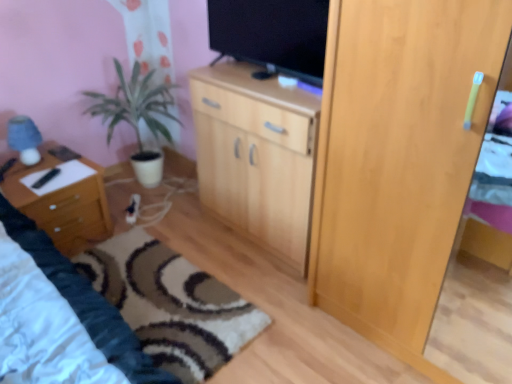
I want to click on carpet with swirl pattern at lower center, so click(x=170, y=304).

Describe the element at coordinates (170, 304) in the screenshot. I see `carpet with swirl pattern at lower center` at that location.

The width and height of the screenshot is (512, 384). Identify the location of green matte plant at left. (137, 117).

This screenshot has height=384, width=512. Identify the location of black glossy tv at upper center. (272, 35).

The width and height of the screenshot is (512, 384). In order to click on wooden cabinet at center in this screenshot , I will do (256, 156).

Image resolution: width=512 pixels, height=384 pixels. What are the coordinates of `light wood cupboard at right` in the screenshot? It's located at (398, 160).

Is black glossy tv at upper center completely or partially inside light wood cupboard at right?

No, black glossy tv at upper center is not surrounded by light wood cupboard at right.

Between point (443, 168) and point (287, 13), which one is positioned behind?

The point (287, 13) is farther from the camera.

From a real-world perspective, is light wood cupboard at right below black glossy tv at upper center?

Yes.

In the scene shown: Is black glossy tv at upper center positioned far away from wooden nightstand at left?

black glossy tv at upper center is positioned a significant distance from wooden nightstand at left.

Is black glossy tv at upper center looking in the opposite direction of wooden nightstand at left?

black glossy tv at upper center is not turned away from wooden nightstand at left.

Is point (294, 38) behind point (26, 172)?

No, it is not.

Considering the sizes of wooden cabinet at center and carpet with swirl pattern at lower center in the image, is wooden cabinet at center taller or shorter than carpet with swirl pattern at lower center?

Clearly, wooden cabinet at center is taller compared to carpet with swirl pattern at lower center.

Can you confirm if wooden cabinet at center is positioned to the right of carpet with swirl pattern at lower center?

Yes, wooden cabinet at center is to the right of carpet with swirl pattern at lower center.

Considering the points (308, 141) and (153, 352), which point is behind, point (308, 141) or point (153, 352)?

Point (308, 141)

Based on the photo, is wooden cabinet at center aimed at carpet with swirl pattern at lower center?

Yes, wooden cabinet at center is aimed at carpet with swirl pattern at lower center.

From the image's perspective, between light wood cupboard at right and carpet with swirl pattern at lower center, who is located below?

carpet with swirl pattern at lower center appears lower in the image.

Locate an element on the screen. cupboard above the carpet with swirl pattern at lower center (from the image's perspective) is located at coordinates (x=398, y=160).

Considering the positions of point (394, 164) and point (152, 305), is point (394, 164) closer or farther from the camera than point (152, 305)?

Point (394, 164) is closer to the camera than point (152, 305).

Is carpet with swirl pattern at lower center at the back of light wood cupboard at right?

No, light wood cupboard at right is not facing away from carpet with swirl pattern at lower center.

Does light wood cupboard at right have a lesser width compared to green matte plant at left?

No, light wood cupboard at right is not thinner than green matte plant at left.

Considering the sizes of objects light wood cupboard at right and green matte plant at left in the image provided, who is taller, light wood cupboard at right or green matte plant at left?

With more height is light wood cupboard at right.

From a real-world perspective, which object rests below the other?

green matte plant at left, from a real-world perspective.

From the image's perspective, does light wood cupboard at right appear lower than green matte plant at left?

Yes, from the image's perspective, light wood cupboard at right is below green matte plant at left.

Can you see carpet with swirl pattern at lower center touching light wood cupboard at right?

carpet with swirl pattern at lower center is not next to light wood cupboard at right, and they're not touching.

Does carpet with swirl pattern at lower center have a lesser width compared to light wood cupboard at right?

In fact, carpet with swirl pattern at lower center might be wider than light wood cupboard at right.

Which of these two, carpet with swirl pattern at lower center or light wood cupboard at right, is bigger?

light wood cupboard at right is bigger.

Consider the image. From a real-world perspective, is carpet with swirl pattern at lower center above or below light wood cupboard at right?

carpet with swirl pattern at lower center is situated lower than light wood cupboard at right in the real world.

Is light wood cupboard at right facing towards wooden cabinet at center?

No, light wood cupboard at right is not aimed at wooden cabinet at center.

Does point (403, 51) lie behind point (278, 173)?

That is False.

From the image's perspective, between light wood cupboard at right and wooden cabinet at center, which one is located above?

wooden cabinet at center appears higher in the image.

Measure the distance from light wood cupboard at right to wooden cabinet at center.

A distance of 16.53 inches exists between light wood cupboard at right and wooden cabinet at center.

Identify the location of television behind the light wood cupboard at right. This screenshot has width=512, height=384. (272, 35).

Where is `nightstand on the left of black glossy tv at upper center`? nightstand on the left of black glossy tv at upper center is located at coordinates (63, 205).

From the image, which object appears to be nearer to black glossy tv at upper center, light wood cupboard at right or wooden nightstand at left?

light wood cupboard at right is closer to black glossy tv at upper center.

In the scene shown: Based on their spatial positions, is wooden cabinet at center or light wood cupboard at right further from black glossy tv at upper center?

light wood cupboard at right lies further to black glossy tv at upper center than the other object.

Estimate the real-world distances between objects in this image. Which object is further from light wood cupboard at right, green matte plant at left or wooden nightstand at left?

Based on the image, wooden nightstand at left appears to be further to light wood cupboard at right.

Considering their positions, is green matte plant at left positioned closer to black glossy tv at upper center than wooden nightstand at left?

The object closer to black glossy tv at upper center is green matte plant at left.

Looking at this image, estimate the real-world distances between objects in this image. Which object is closer to wooden cabinet at center, wooden nightstand at left or green matte plant at left?

Among the two, green matte plant at left is located nearer to wooden cabinet at center.

Looking at the image, which one is located closer to light wood cupboard at right, wooden nightstand at left or green matte plant at left?

Among the two, green matte plant at left is located nearer to light wood cupboard at right.

From the image, which object appears to be nearer to green matte plant at left, wooden nightstand at left or carpet with swirl pattern at lower center?

wooden nightstand at left lies closer to green matte plant at left than the other object.

From the image, which object appears to be nearer to wooden cabinet at center, wooden nightstand at left or light wood cupboard at right?

light wood cupboard at right is closer to wooden cabinet at center.

I want to click on plain located between wooden nightstand at left and light wood cupboard at right in the left-right direction, so click(x=170, y=304).

Where is `plain located between green matte plant at left and light wood cupboard at right in the left-right direction`? plain located between green matte plant at left and light wood cupboard at right in the left-right direction is located at coordinates [170, 304].

Locate an element on the screen. television between green matte plant at left and wooden cabinet at center is located at coordinates (272, 35).

I want to click on houseplant between wooden nightstand at left and light wood cupboard at right in the horizontal direction, so click(x=137, y=117).